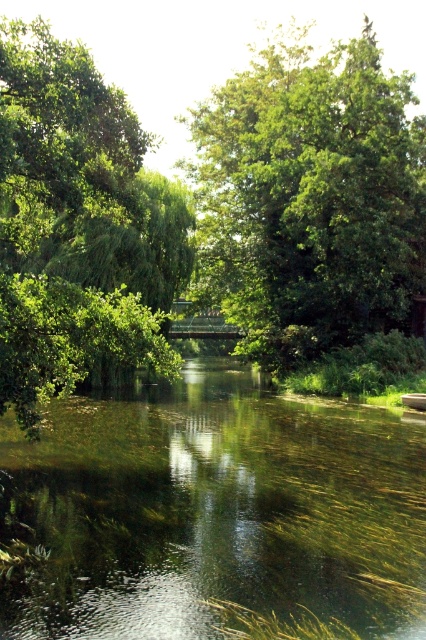
You are standing at the point marked by coordinates point (310, 198) in the image. What is the closest object to you?

The point (310, 198) indicates green leafy tree at center, so the closest object to you is the green leafy tree at center.

You are standing at the edge of the green grassy lake at center and want to see the top of the green leafy tree at center. Can you see the top of the tree without moving your position?

The green grassy lake at center is shorter than the green leafy tree at center, so yes, you can see the top of the green leafy tree at center from your current position since it is taller than the lake.

Based on the coordinates provided, where exactly is the green grassy lake at center located in the image?

The green grassy lake at center is located at the 2D coordinates point of (219,509).